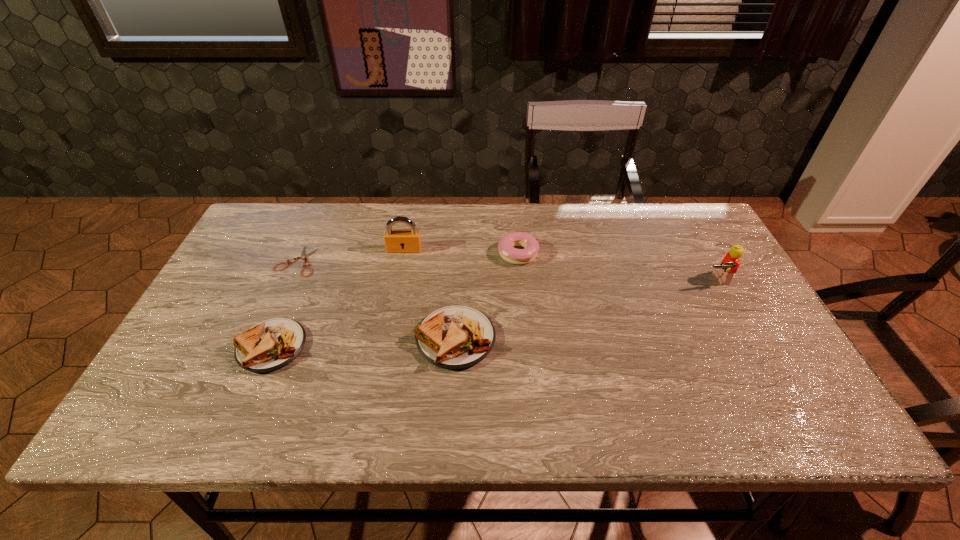
Where is `free location located 0.180m on the front of the shortest object`? Image resolution: width=960 pixels, height=540 pixels. free location located 0.180m on the front of the shortest object is located at coordinates (268, 327).

Identify the location of free location located 0.290m on the front of the second object from right to left. (527, 349).

Where is `vacant space situated 0.400m to unlock the fourth object from right to left from the front`? vacant space situated 0.400m to unlock the fourth object from right to left from the front is located at coordinates (382, 366).

Identify the location of shears located in the far edge section of the desktop. The height and width of the screenshot is (540, 960). (303, 256).

The width and height of the screenshot is (960, 540). In order to click on doughnut present at the far edge in this screenshot , I will do `click(506, 244)`.

Find the location of a particular element. This screenshot has height=540, width=960. padlock that is at the far edge is located at coordinates (396, 241).

Find the location of `sandwich located at the left edge`. sandwich located at the left edge is located at coordinates (270, 345).

Where is `shears located at the left edge`? The image size is (960, 540). shears located at the left edge is located at coordinates (303, 256).

You are a GUI agent. You are given a task and a screenshot of the screen. Output one action in this format:
    pyautogui.click(x=<x>, y=<y>)
    Task: Click on the object positioned at the right edge
    
    Given the screenshot: What is the action you would take?
    pyautogui.click(x=729, y=265)

Locate an element on the screen. The image size is (960, 540). object situated at the far left corner is located at coordinates (303, 256).